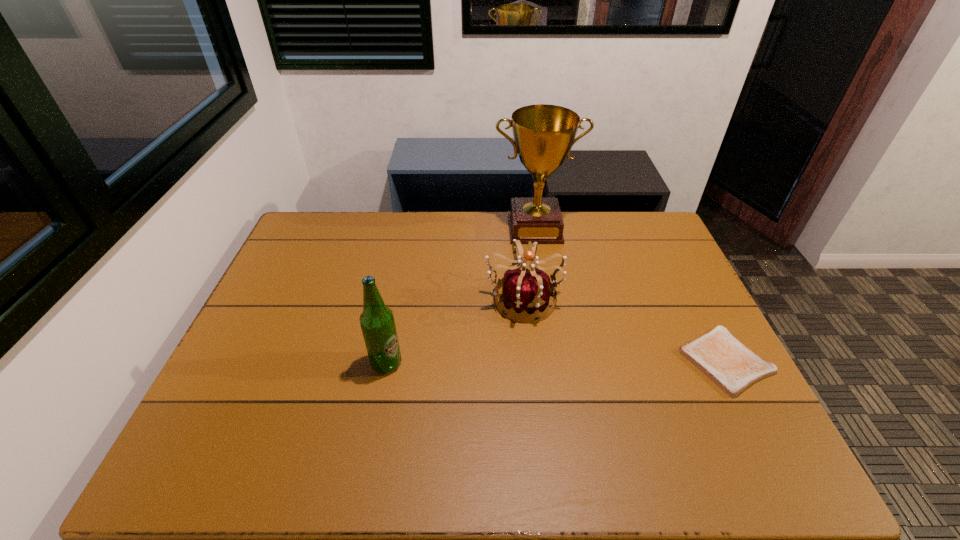
Where is `empty space between the tallest object and the third tallest object`? The image size is (960, 540). empty space between the tallest object and the third tallest object is located at coordinates (529, 264).

The height and width of the screenshot is (540, 960). Find the location of `vacant region between the award and the second farthest object`. vacant region between the award and the second farthest object is located at coordinates (529, 264).

At what (x,y) coordinates should I click in order to perform the action: click on vacant space that's between the third nearest object and the award. Please return your answer as a coordinate pair (x, y). The height and width of the screenshot is (540, 960). Looking at the image, I should click on (529, 264).

Where is `unoccupied position between the toast and the second farthest object`? unoccupied position between the toast and the second farthest object is located at coordinates (624, 330).

Find the location of a particular element. The height and width of the screenshot is (540, 960). free space between the beer bottle and the third nearest object is located at coordinates (455, 332).

Find the location of a particular element. This screenshot has height=540, width=960. free space that is in between the beer bottle and the third tallest object is located at coordinates (455, 332).

Point out which object is positioned as the second nearest to the award. Please provide its 2D coordinates. Your answer should be formatted as a tuple, i.e. [(x, y)], where the tuple contains the x and y coordinates of a point satisfying the conditions above.

[(728, 363)]

Where is `object that is the nearest to the tallest object`? This screenshot has height=540, width=960. object that is the nearest to the tallest object is located at coordinates (524, 290).

Find the location of a particular element. free location that satisfies the following two spatial constraints: 1. on the front side of the rightmost object; 2. on the left side of the third nearest object is located at coordinates (530, 361).